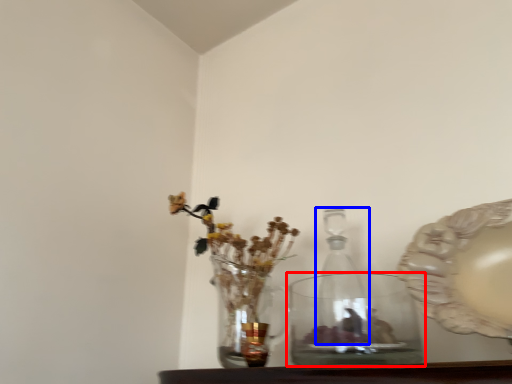
Question: Among these objects, which one is farthest to the camera, vase (highlighted by a red box) or glass bottle (highlighted by a blue box)?

Choices:
 (A) vase
 (B) glass bottle

Answer: (B)